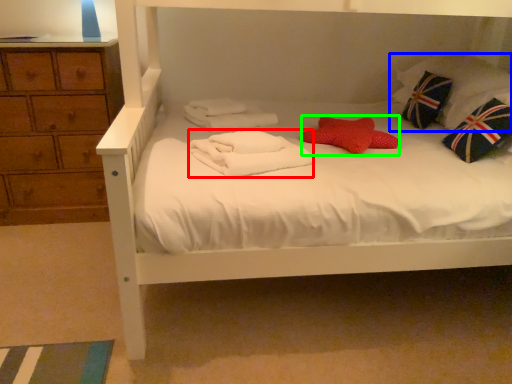
Question: Which is nearer to the bath towel (highlighted by a red box)? pillow (highlighted by a blue box) or pillow (highlighted by a green box).

Choices:
 (A) pillow
 (B) pillow

Answer: (B)